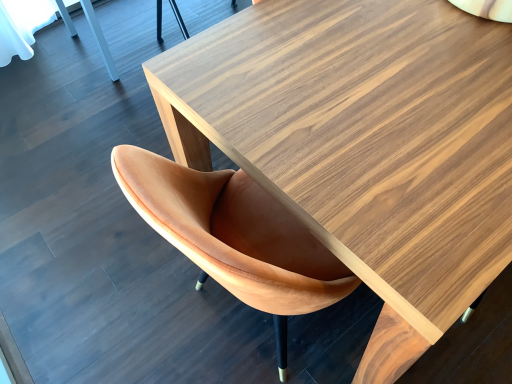
Measure the distance between wooden table at center and camera.

The depth of wooden table at center is 26.48 inches.

Describe the element at coordinates (364, 144) in the screenshot. The image size is (512, 384). I see `wooden table at center` at that location.

Identify the location of wooden table at center. The width and height of the screenshot is (512, 384). (364, 144).

Locate an element on the screen. This screenshot has width=512, height=384. wooden table at center is located at coordinates (364, 144).